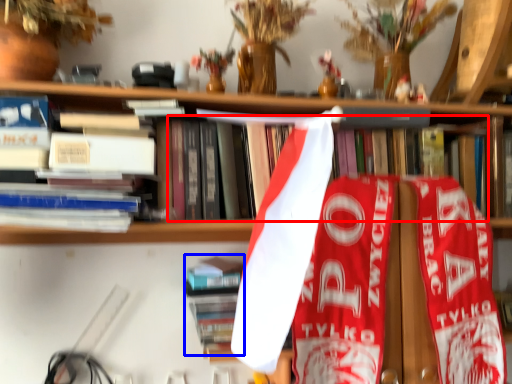
Question: Which point is closer to the camera, book (highlighted by a red box) or book (highlighted by a blue box)?

Choices:
 (A) book
 (B) book

Answer: (A)